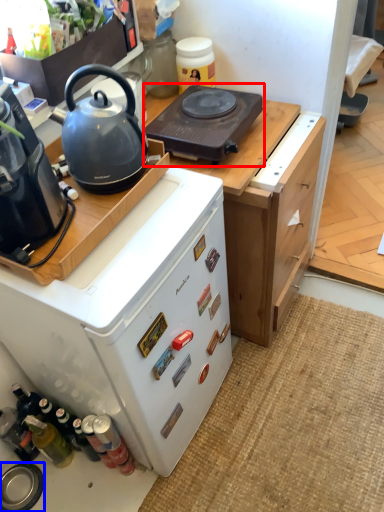
Question: Which of the following is the farthest to the observer, gas stove (highlighted by a red box) or kitchen appliance (highlighted by a blue box)?

Choices:
 (A) gas stove
 (B) kitchen appliance

Answer: (B)